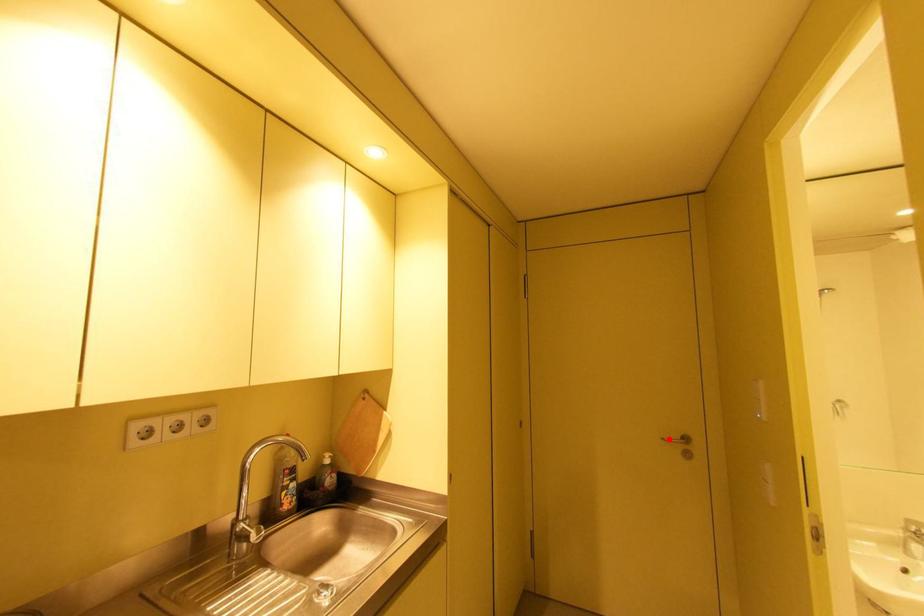
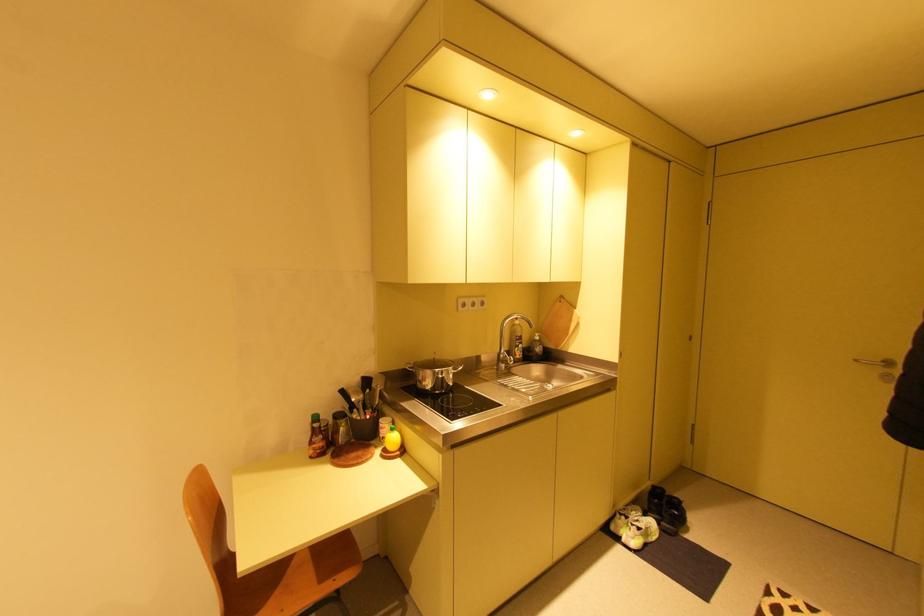
Question: A red point is marked in image1. In image2, is the corresponding 3D point closer to the camera or farther? Reply with the corresponding letter.

Choices:
 (A) The corresponding 3D point is closer.
 (B) The corresponding 3D point is farther.

Answer: (B)